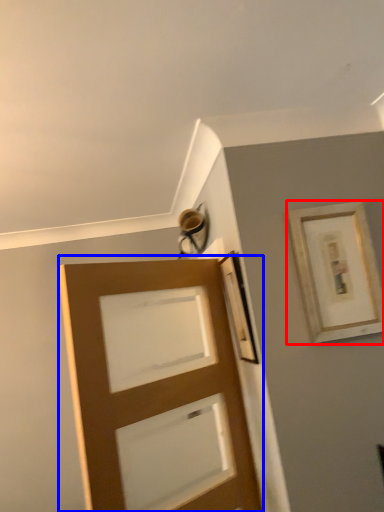
Question: Which point is closer to the camera, picture frame (highlighted by a red box) or door (highlighted by a blue box)?

Choices:
 (A) picture frame
 (B) door

Answer: (B)